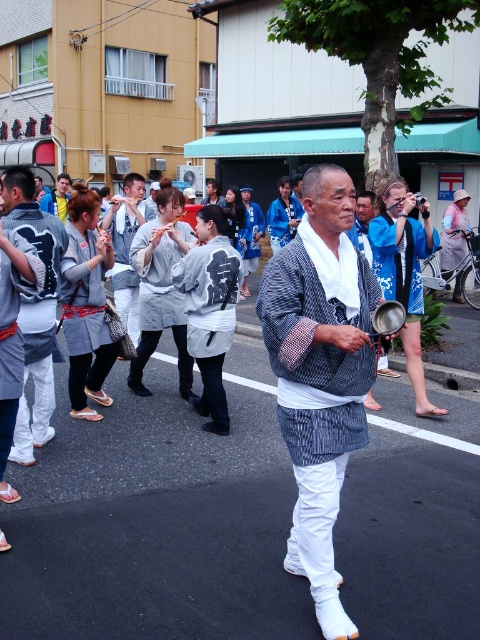
You are a photographer trying to capture both the white striped kimono at center and the gray fabric kimono at center in a single frame. Which kimono should you focus on to ensure both are visible without cropping?

The white striped kimono at center is much taller than the gray fabric kimono at center, so focusing on the taller one will ensure both are visible in the frame.